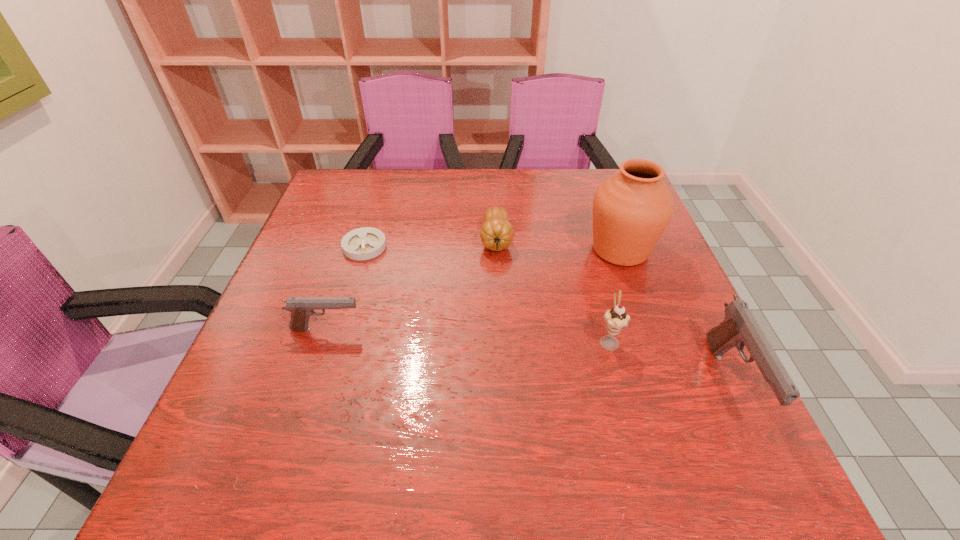
Where is `unoccupied area between the tallest object and the left pistol`? unoccupied area between the tallest object and the left pistol is located at coordinates (473, 289).

Locate an element on the screen. vacant area that lies between the shorter pistol and the gourd is located at coordinates (411, 285).

This screenshot has height=540, width=960. I want to click on object that is the closest to the farther pistol, so click(x=364, y=243).

You are a GUI agent. You are given a task and a screenshot of the screen. Output one action in this format:
    pyautogui.click(x=<x>, y=<y>)
    Task: Click on the object that is the second closest to the icecream
    The width and height of the screenshot is (960, 540).
    Given the screenshot: What is the action you would take?
    pyautogui.click(x=739, y=328)

The height and width of the screenshot is (540, 960). What are the coordinates of `vacant region that satisfies the following two spatial constraints: 1. on the back side of the icecream; 2. at the barrel of the farther pistol` in the screenshot? It's located at (606, 329).

Image resolution: width=960 pixels, height=540 pixels. I want to click on vacant region that satisfies the following two spatial constraints: 1. on the back side of the icecream; 2. on the left side of the tallest object, so click(x=584, y=250).

Locate an element on the screen. This screenshot has height=540, width=960. free spot that satisfies the following two spatial constraints: 1. at the barrel of the shorter pistol; 2. on the back side of the icecream is located at coordinates (323, 340).

Identify the location of vacant space that satisfies the following two spatial constraints: 1. at the barrel of the left pistol; 2. on the right side of the icecream. (323, 340).

You are a GUI agent. You are given a task and a screenshot of the screen. Output one action in this format:
    pyautogui.click(x=<x>, y=<y>)
    Task: Click on the free space that satisfies the following two spatial constraints: 1. on the stem side of the gourd; 2. at the barrel of the left pistol
    The height and width of the screenshot is (540, 960).
    Given the screenshot: What is the action you would take?
    pyautogui.click(x=500, y=329)

Where is `vacant position in the image that satisfies the following two spatial constraints: 1. on the stem side of the gourd; 2. at the barrel of the left pistol`? vacant position in the image that satisfies the following two spatial constraints: 1. on the stem side of the gourd; 2. at the barrel of the left pistol is located at coordinates (500, 329).